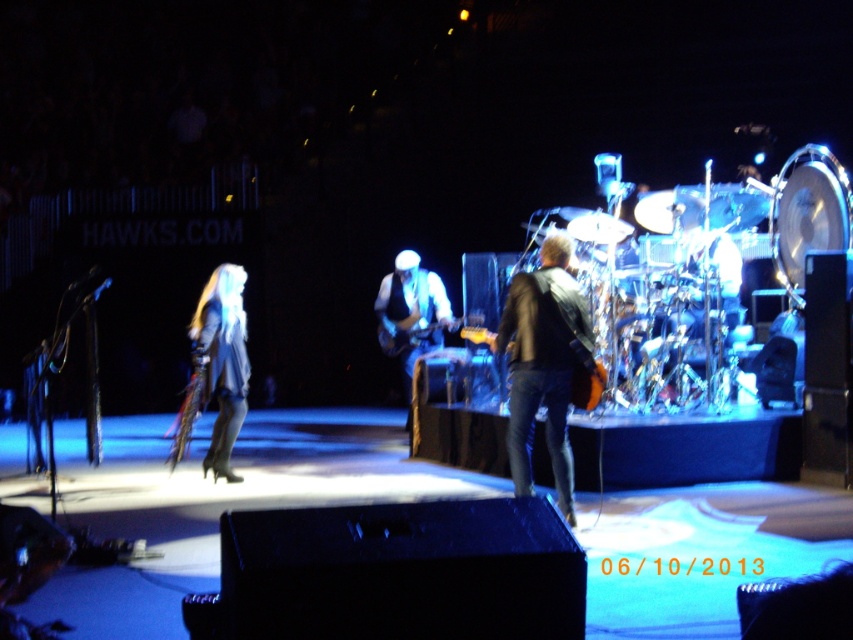
Question: Does satin blue dress at left lie behind shiny silver drum at right?

Choices:
 (A) no
 (B) yes

Answer: (B)

Question: Does leather jacket at center appear over orange matte guitar at center?

Choices:
 (A) yes
 (B) no

Answer: (B)

Question: Which of the following is the farthest from the observer?

Choices:
 (A) (849, 225)
 (B) (212, 282)
 (C) (705, 236)

Answer: (B)

Question: Which object is farther from the camera taking this photo?

Choices:
 (A) shiny black guitar at center
 (B) orange matte guitar at center
 (C) shiny silver drum at right
 (D) satin blue dress at left

Answer: (A)

Question: Which point is farther from the camera taking this photo?

Choices:
 (A) (209, 300)
 (B) (596, 384)

Answer: (A)

Question: In this image, where is satin blue dress at left located relative to shiny black guitar at center?

Choices:
 (A) right
 (B) left

Answer: (B)